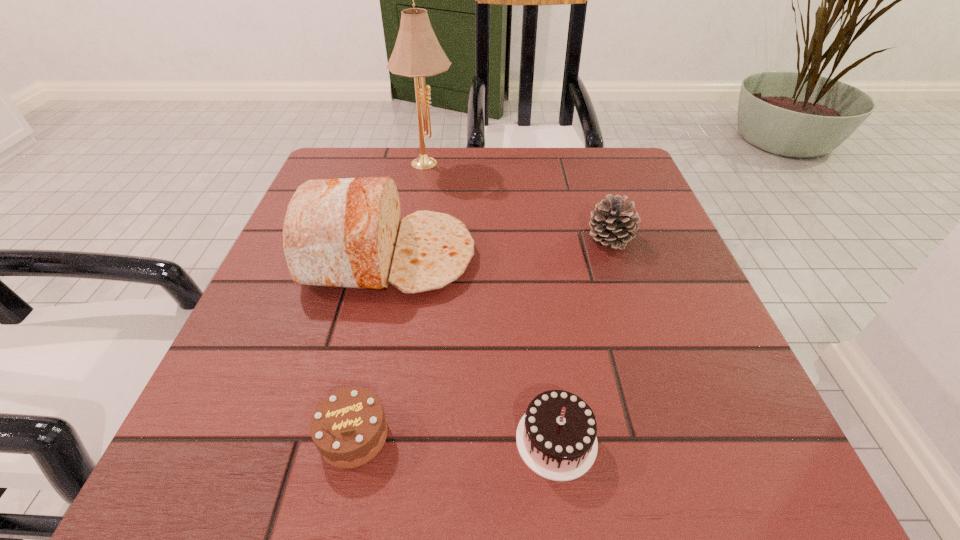
Where is `vacant space at the right edge of the desktop`? Image resolution: width=960 pixels, height=540 pixels. vacant space at the right edge of the desktop is located at coordinates (709, 315).

I want to click on blank space at the near left corner, so click(294, 441).

In the image, there is a desktop. Identify the location of vacant space at the far right corner. (580, 160).

Where is `vacant space that's between the left chocolate cake and the second tallest object`? The image size is (960, 540). vacant space that's between the left chocolate cake and the second tallest object is located at coordinates (372, 346).

Image resolution: width=960 pixels, height=540 pixels. In order to click on free area in between the third shortest object and the shorter chocolate cake in this screenshot , I will do `click(482, 337)`.

The width and height of the screenshot is (960, 540). I want to click on free space that is in between the shorter chocolate cake and the taller chocolate cake, so click(x=455, y=438).

At what (x,y) coordinates should I click in order to perform the action: click on vacant area that lies between the tallest object and the rightmost object. Please return your answer as a coordinate pair (x, y). Image resolution: width=960 pixels, height=540 pixels. Looking at the image, I should click on (518, 199).

At what (x,y) coordinates should I click in order to perform the action: click on free area in between the rightmost object and the left chocolate cake. Please return your answer as a coordinate pair (x, y). The height and width of the screenshot is (540, 960). Looking at the image, I should click on (482, 337).

Find the location of a particular element. The width and height of the screenshot is (960, 540). empty location between the shortest object and the bread is located at coordinates pyautogui.click(x=372, y=346).

Where is `free space between the right chocolate cake and the shorter chocolate cake`? The height and width of the screenshot is (540, 960). free space between the right chocolate cake and the shorter chocolate cake is located at coordinates (455, 438).